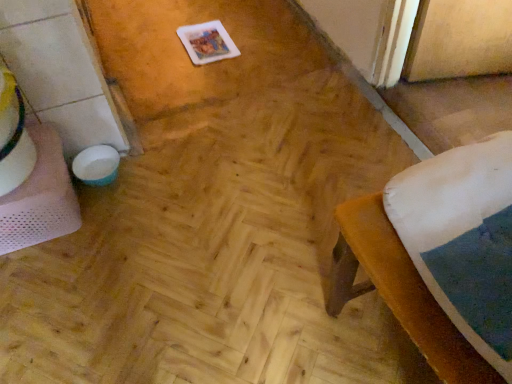
What is the approximate width of brown fabric stool at lower right?

brown fabric stool at lower right is 22.27 inches wide.

Describe the element at coordinates (440, 258) in the screenshot. I see `brown fabric stool at lower right` at that location.

This screenshot has width=512, height=384. I want to click on brown fabric stool at lower right, so click(440, 258).

The width and height of the screenshot is (512, 384). I want to click on white mesh table at left, so click(x=40, y=198).

This screenshot has width=512, height=384. What do you see at coordinates (40, 198) in the screenshot?
I see `white mesh table at left` at bounding box center [40, 198].

You are a GUI agent. You are given a task and a screenshot of the screen. Output one action in this format:
    pyautogui.click(x=<x>, y=<y>)
    Task: Click on the brown fabric stool at lower right
    
    Given the screenshot: What is the action you would take?
    pyautogui.click(x=440, y=258)

Is white mesh table at left to the right of brown fabric stool at lower right from the viewer's perspective?

No, white mesh table at left is not to the right of brown fabric stool at lower right.

Which object is closer to the camera taking this photo, white mesh table at left or brown fabric stool at lower right?

brown fabric stool at lower right.

Is point (57, 213) less distant than point (458, 273)?

No, it is behind (458, 273).

From the image's perspective, which one is positioned higher, white mesh table at left or brown fabric stool at lower right?

white mesh table at left appears higher in the image.

From a real-world perspective, which is physically above, white mesh table at left or brown fabric stool at lower right?

brown fabric stool at lower right, from a real-world perspective.

Which object is wider, white mesh table at left or brown fabric stool at lower right?

With larger width is brown fabric stool at lower right.

Which of these two, white mesh table at left or brown fabric stool at lower right, stands shorter?

Standing shorter between the two is white mesh table at left.

Does white mesh table at left have a smaller size compared to brown fabric stool at lower right?

Yes.

Is white mesh table at left situated inside brown fabric stool at lower right or outside?

white mesh table at left is outside brown fabric stool at lower right.

Is white mesh table at left far away from brown fabric stool at lower right?

white mesh table at left is near brown fabric stool at lower right, not far away.

Is white mesh table at left facing away from brown fabric stool at lower right?

No, white mesh table at left's orientation is not away from brown fabric stool at lower right.

How many degrees apart are the facing directions of white mesh table at left and brown fabric stool at lower right?

white mesh table at left and brown fabric stool at lower right are facing 92 degrees away from each other.

Image resolution: width=512 pixels, height=384 pixels. Find the location of `furniture that appears in front of the white mesh table at left`. furniture that appears in front of the white mesh table at left is located at coordinates point(440,258).

From the picture: Between brown fabric stool at lower right and white mesh table at left, which one appears on the left side from the viewer's perspective?

white mesh table at left.

Between brown fabric stool at lower right and white mesh table at left, which one is positioned in front?

Positioned in front is brown fabric stool at lower right.

Considering the positions of point (368, 210) and point (65, 191), is point (368, 210) closer or farther from the camera than point (65, 191)?

Point (368, 210) appears to be closer to the viewer than point (65, 191).

From the image's perspective, is brown fabric stool at lower right above or below white mesh table at left?

brown fabric stool at lower right is below white mesh table at left.

From a real-world perspective, is brown fabric stool at lower right above or below white mesh table at left?

In terms of real-world spatial position, brown fabric stool at lower right is above white mesh table at left.

Considering the sizes of objects brown fabric stool at lower right and white mesh table at left in the image provided, who is thinner, brown fabric stool at lower right or white mesh table at left?

white mesh table at left.

Who is taller, brown fabric stool at lower right or white mesh table at left?

brown fabric stool at lower right.

Who is smaller, brown fabric stool at lower right or white mesh table at left?

Smaller between the two is white mesh table at left.

Is brown fabric stool at lower right outside of white mesh table at left?

Yes, brown fabric stool at lower right is not within white mesh table at left.

Is brown fabric stool at lower right not near white mesh table at left?

No, brown fabric stool at lower right is in close proximity to white mesh table at left.

Is brown fabric stool at lower right positioned with its back to white mesh table at left?

No, brown fabric stool at lower right is not facing away from white mesh table at left.

How distant is brown fabric stool at lower right from white mesh table at left?

brown fabric stool at lower right and white mesh table at left are 88.28 centimeters apart from each other.

Locate an element on the screen. This screenshot has width=512, height=384. furniture above the white mesh table at left (from a real-world perspective) is located at coordinates (440, 258).

The width and height of the screenshot is (512, 384). I want to click on table below the brown fabric stool at lower right (from a real-world perspective), so click(x=40, y=198).

At what (x,y) coordinates should I click in order to perform the action: click on table located above the brown fabric stool at lower right (from the image's perspective). Please return your answer as a coordinate pair (x, y). Image resolution: width=512 pixels, height=384 pixels. Looking at the image, I should click on (40, 198).